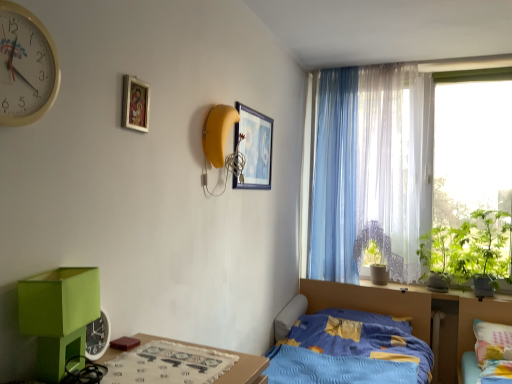
Question: Is multicolored fabric bed at lower right, the 1th bed positioned from the right, not within green matte changing table at lower left?

Choices:
 (A) no
 (B) yes

Answer: (B)

Question: Can you confirm if multicolored fabric bed at lower right, the 2th bed in the left-to-right sequence, is smaller than green matte changing table at lower left?

Choices:
 (A) no
 (B) yes

Answer: (A)

Question: From the image's perspective, is multicolored fabric bed at lower right, the 2th bed in the left-to-right sequence, on green matte changing table at lower left?

Choices:
 (A) no
 (B) yes

Answer: (A)

Question: Does multicolored fabric bed at lower right, the 1th bed positioned from the right, have a lesser height compared to green matte changing table at lower left?

Choices:
 (A) no
 (B) yes

Answer: (A)

Question: Is multicolored fabric bed at lower right, the 2th bed in the left-to-right sequence, oriented towards green matte changing table at lower left?

Choices:
 (A) yes
 (B) no

Answer: (B)

Question: Is green matte changing table at lower left located within multicolored fabric bed at lower right, the 1th bed positioned from the right?

Choices:
 (A) yes
 (B) no

Answer: (B)

Question: Considering the relative sizes of yellow plastic clock at upper left and green leafy plant at window, which is the second plant from left to right, in the image provided, is yellow plastic clock at upper left smaller than green leafy plant at window, which is the second plant from left to right,?

Choices:
 (A) yes
 (B) no

Answer: (A)

Question: From a real-world perspective, is yellow plastic clock at upper left physically above green leafy plant at window, which is the second plant from left to right?

Choices:
 (A) no
 (B) yes

Answer: (B)

Question: Can you confirm if yellow plastic clock at upper left is taller than green leafy plant at window, which is the second plant from left to right?

Choices:
 (A) no
 (B) yes

Answer: (A)

Question: From the image's perspective, is yellow plastic clock at upper left on top of green leafy plant at window, which is the second plant from left to right?

Choices:
 (A) yes
 (B) no

Answer: (A)

Question: From a real-world perspective, is yellow plastic clock at upper left beneath green leafy plant at window, the 2th plant in the right-to-left sequence?

Choices:
 (A) yes
 (B) no

Answer: (B)

Question: Are yellow plastic clock at upper left and green leafy plant at window, the 2th plant in the right-to-left sequence, beside each other?

Choices:
 (A) no
 (B) yes

Answer: (A)

Question: From the image's perspective, would you say wooden picture frame at upper center, positioned as the 2th picture frame in front-to-back order, is shown under green leafy plant at window, which is the second plant from left to right?

Choices:
 (A) yes
 (B) no

Answer: (B)